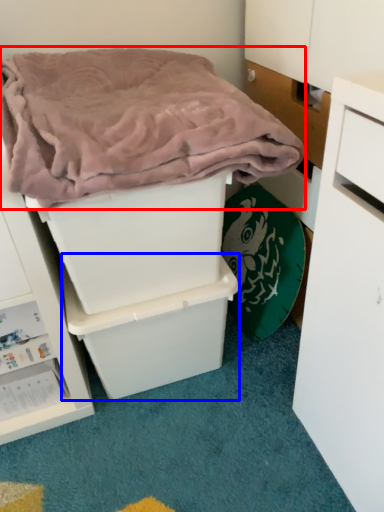
Question: Which point is closer to the camera, blanket (highlighted by a red box) or storage box (highlighted by a blue box)?

Choices:
 (A) blanket
 (B) storage box

Answer: (A)